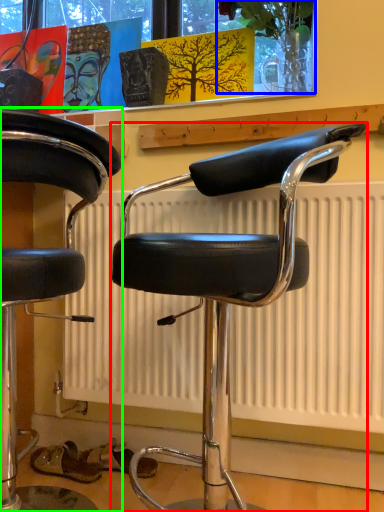
Question: Considering the real-world distances, which object is closest to chair (highlighted by a red box)? plant (highlighted by a blue box) or chair (highlighted by a green box).

Choices:
 (A) plant
 (B) chair

Answer: (B)